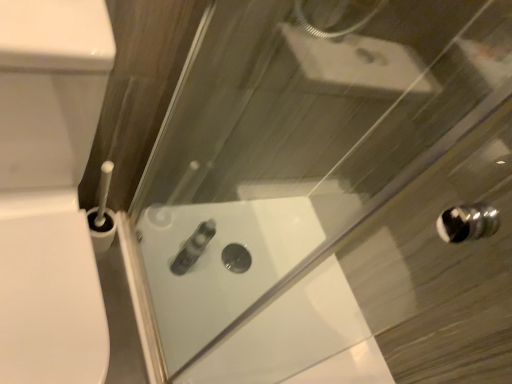
The height and width of the screenshot is (384, 512). In order to click on vacant area located to the right-hand side of satin silver tube at center in this screenshot , I will do `click(207, 296)`.